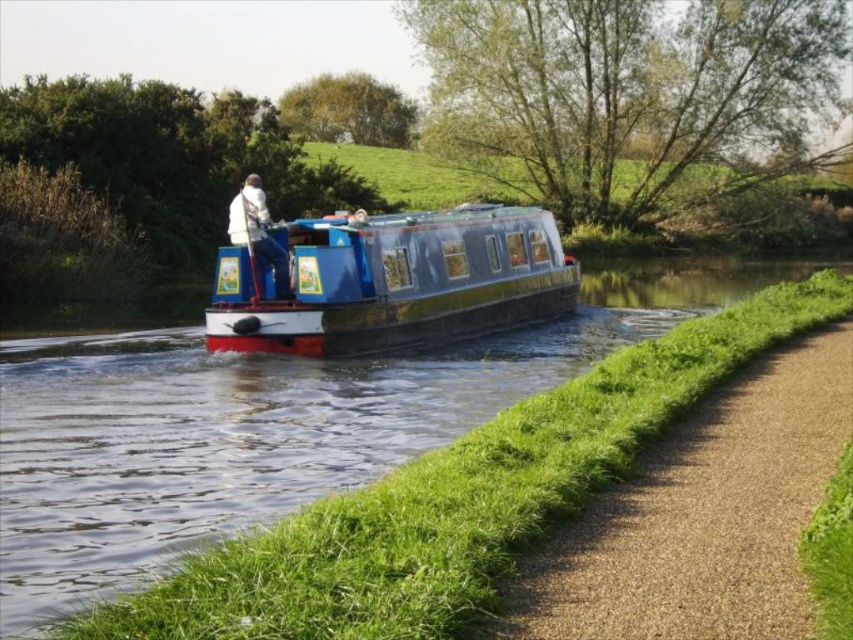
Is gravel path at lower right above white matte jacket at center?

No.

Between gravel path at lower right and white matte jacket at center, which one is positioned lower?

gravel path at lower right is below.

Describe the element at coordinates (703, 516) in the screenshot. I see `gravel path at lower right` at that location.

Identify the location of gravel path at lower right. (703, 516).

Is blue glossy canal boat at center to the right of white matte jacket at center from the viewer's perspective?

Indeed, blue glossy canal boat at center is positioned on the right side of white matte jacket at center.

This screenshot has width=853, height=640. I want to click on blue glossy canal boat at center, so click(270, 424).

The width and height of the screenshot is (853, 640). Identify the location of blue glossy canal boat at center. (270, 424).

Can you confirm if blue glossy canal boat at center is taller than gravel path at lower right?

Yes.

Can you confirm if blue glossy canal boat at center is positioned to the right of gravel path at lower right?

No, blue glossy canal boat at center is not to the right of gravel path at lower right.

Locate an element on the screen. The width and height of the screenshot is (853, 640). blue glossy canal boat at center is located at coordinates (270, 424).

Where is `blue glossy canal boat at center`? Image resolution: width=853 pixels, height=640 pixels. blue glossy canal boat at center is located at coordinates (270, 424).